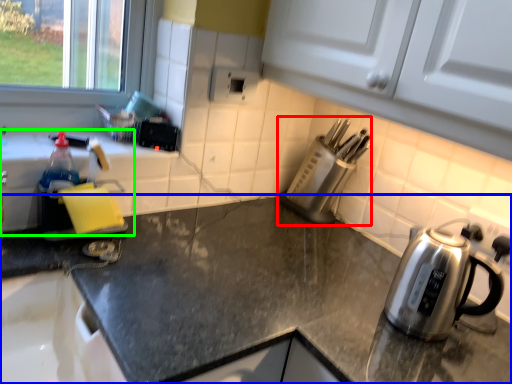
Question: Based on their relative distances, which object is nearer to appliance (highlighted by a red box)? Choose from countertop (highlighted by a blue box) and sink (highlighted by a green box).

Choices:
 (A) countertop
 (B) sink

Answer: (A)